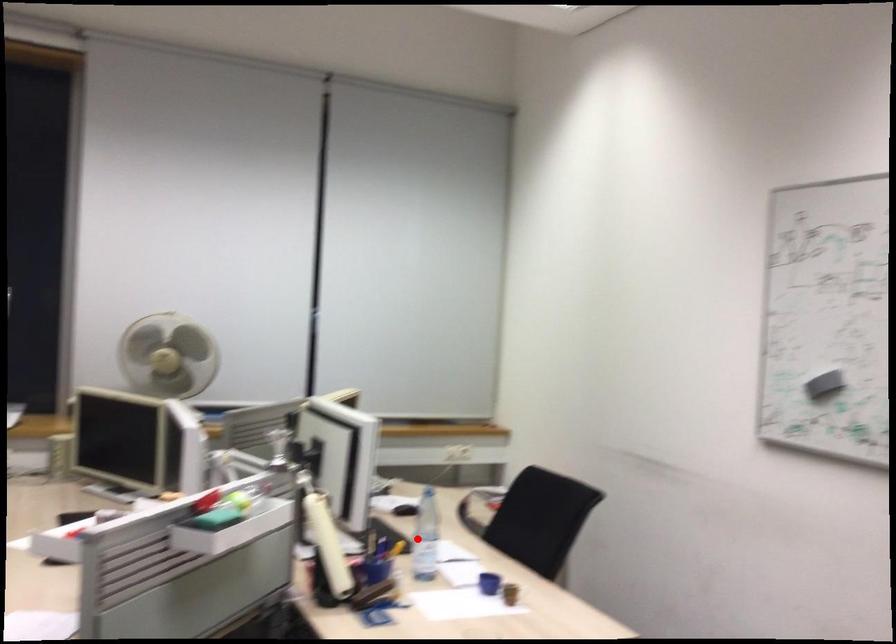
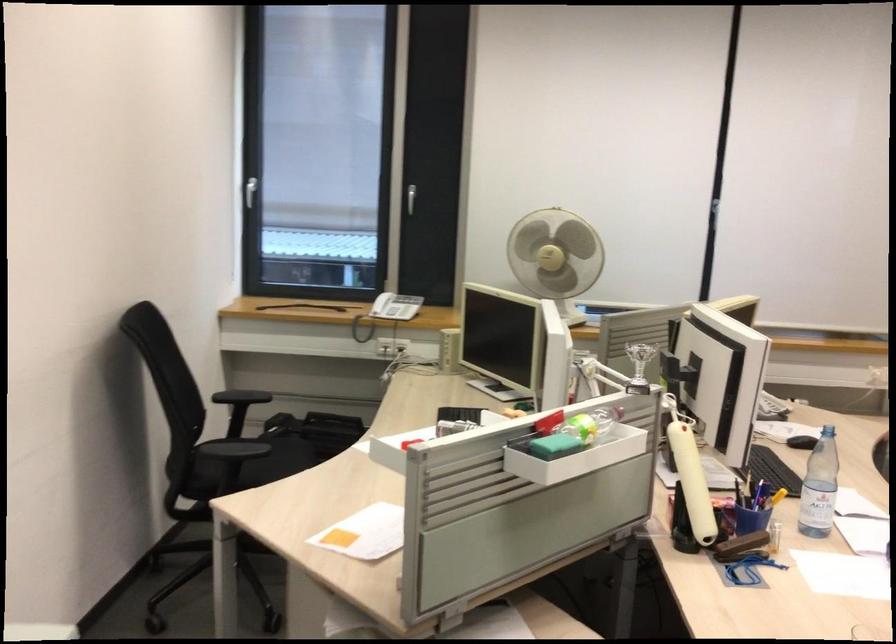
Question: I am providing you with two images of the same scene from different viewpoints. Given a red point in image1, look at the same physical point in image2. Is it:

Choices:
 (A) Closer to the viewpoint
 (B) Farther from the viewpoint

Answer: (A)